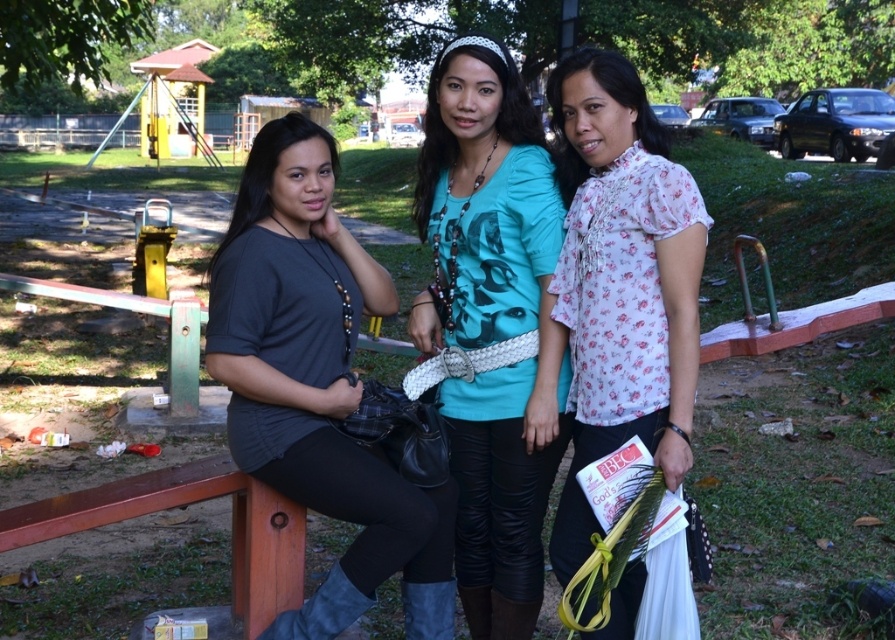
Question: Which object is positioned farthest from the white floral blouse at center?

Choices:
 (A) matte black shirt at left
 (B) teal printed shirt at center

Answer: (A)

Question: Which object is farther from the camera taking this photo?

Choices:
 (A) matte black shirt at left
 (B) teal printed shirt at center
 (C) white floral blouse at center

Answer: (B)

Question: Is teal printed shirt at center positioned before white floral blouse at center?

Choices:
 (A) yes
 (B) no

Answer: (B)

Question: Which object is positioned farthest from the white floral blouse at center?

Choices:
 (A) matte black shirt at left
 (B) teal printed shirt at center

Answer: (A)

Question: Is matte black shirt at left thinner than white floral blouse at center?

Choices:
 (A) no
 (B) yes

Answer: (A)

Question: Is matte black shirt at left thinner than white floral blouse at center?

Choices:
 (A) no
 (B) yes

Answer: (A)